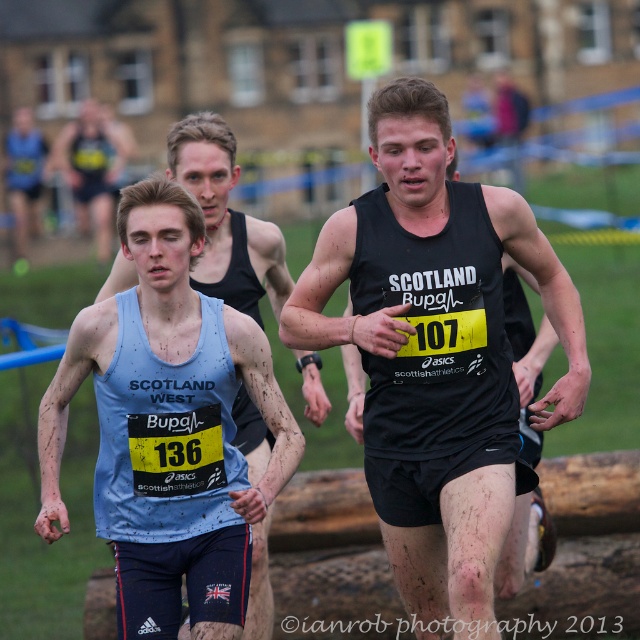
You are a photographer at the cross country race. You need to capture a photo of the black matte tank top at center and the matte black tank top at center. Which one is positioned lower in the image?

The black matte tank top at center is positioned lower than the matte black tank top at center in the image.

You are a photographer at the cross country race. You want to take a photo of the black matte tank top at center and the matte black tank top at center. Which one is taller?

The black matte tank top at center is taller than the matte black tank top at center according to the description.

You are a photographer positioned at the starting line of the cross country race. You want to capture a photo of the matte black tank top at center and the light blue tank top at left. Based on their positions, which runner is closer to the right side of your camera frame?

The matte black tank top at center is to the right of the light blue tank top at left, so the runner wearing the matte black tank top at center is closer to the right side of the camera frame.